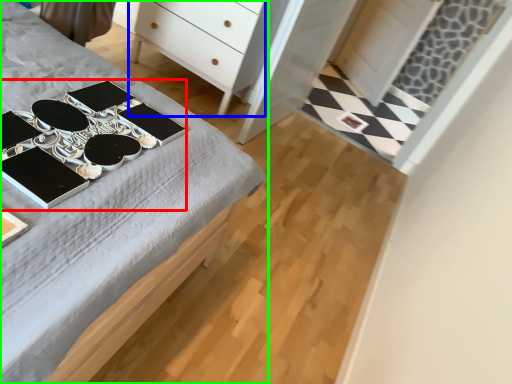
Question: Which is farther away from changing table (highlighted by a red box)? chest of drawers (highlighted by a blue box) or desk (highlighted by a green box)?

Choices:
 (A) chest of drawers
 (B) desk

Answer: (A)